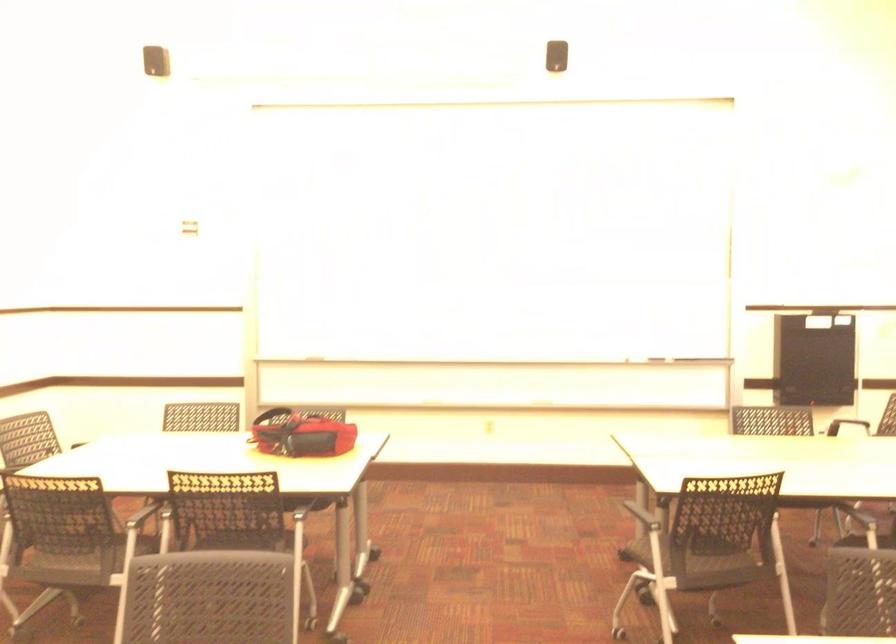
The location [688,361] corresponds to which object?

This point indicates the whiteboard marker.